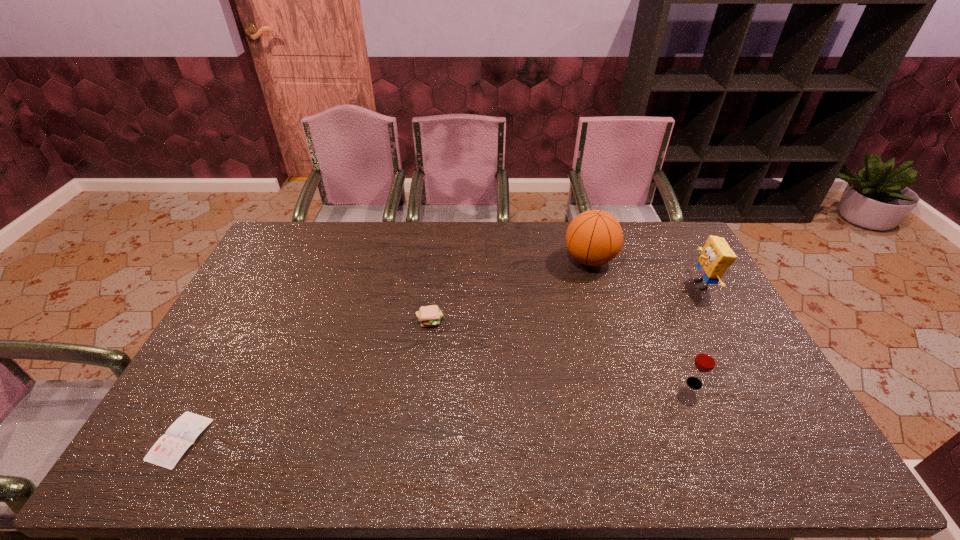
You are a GUI agent. You are given a task and a screenshot of the screen. Output one action in this format:
    pyautogui.click(x=<x>, y=<y>)
    Task: Click on the object present at the near left corner
    The height and width of the screenshot is (540, 960).
    Given the screenshot: What is the action you would take?
    tap(166, 452)

Locate an element on the screen. This screenshot has height=540, width=960. vacant space at the far edge of the desktop is located at coordinates (419, 221).

This screenshot has width=960, height=540. Find the location of `vacant space at the near edge of the desktop`. vacant space at the near edge of the desktop is located at coordinates (658, 457).

The image size is (960, 540). I want to click on free location at the left edge, so click(262, 335).

The width and height of the screenshot is (960, 540). Identify the location of vacant area at the right edge. (729, 313).

I want to click on blank space at the far left corner, so click(x=295, y=239).

I want to click on vacant region at the far right corner, so click(x=660, y=247).

Identify the location of vacant area between the basketball and the third tallest object. Image resolution: width=960 pixels, height=540 pixels. (642, 322).

Locate an element on the screen. This screenshot has width=960, height=540. unoccupied position between the shortest object and the patty is located at coordinates (304, 380).

I want to click on vacant area that lies between the second shortest object and the basketball, so click(510, 290).